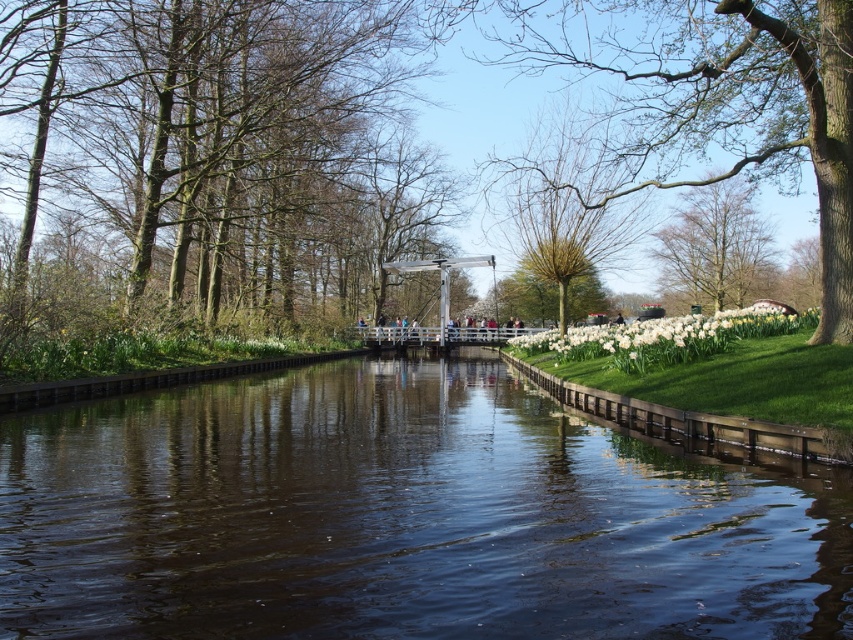
Can you confirm if dark brown water at center is smaller than bare branches at upper center?

Indeed, dark brown water at center has a smaller size compared to bare branches at upper center.

Which is behind, point (184, 541) or point (621, 248)?

Positioned behind is point (621, 248).

Is point (241, 544) closer to camera compared to point (584, 227)?

That is True.

The image size is (853, 640). I want to click on dark brown water at center, so click(x=399, y=516).

Does green leafy tree at upper center have a greater width compared to white glossy daffodil at right?

Incorrect, green leafy tree at upper center's width does not surpass white glossy daffodil at right's.

Does green leafy tree at upper center appear on the right side of white glossy daffodil at right?

Correct, you'll find green leafy tree at upper center to the right of white glossy daffodil at right.

Which is behind, point (720, 220) or point (570, 360)?

The point (720, 220) is more distant.

Find the location of a particular element. This screenshot has width=853, height=640. green leafy tree at upper center is located at coordinates (715, 246).

Based on the photo, does bare branches at upper center have a greater height compared to white glossy daffodil at right?

Correct, bare branches at upper center is much taller as white glossy daffodil at right.

How much distance is there between bare branches at upper center and white glossy daffodil at right?

bare branches at upper center and white glossy daffodil at right are 5.50 meters apart from each other.

Locate an element on the screen. This screenshot has width=853, height=640. bare branches at upper center is located at coordinates pos(563,204).